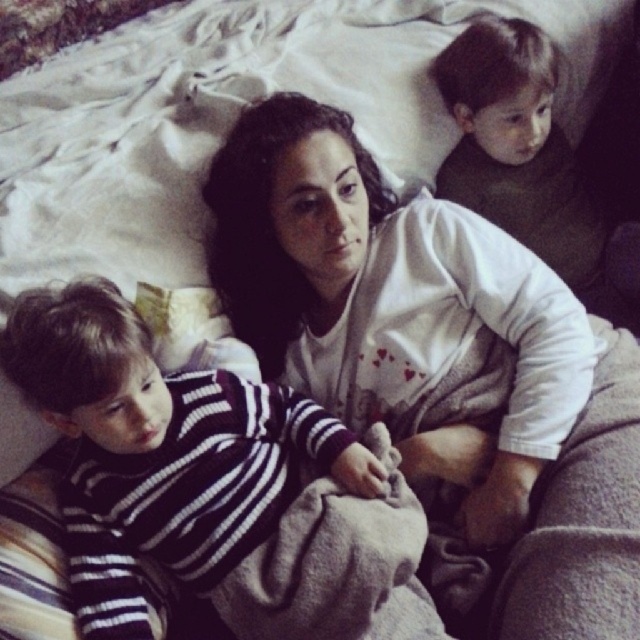
Between white soft sweater at center and striped knit sweater at left, which one is positioned lower?

striped knit sweater at left is below.

Which is more to the left, white soft sweater at center or striped knit sweater at left?

Positioned to the left is striped knit sweater at left.

Between point (540, 456) and point (147, 484), which one is positioned behind?

Point (540, 456)

Locate an element on the screen. This screenshot has height=640, width=640. white soft sweater at center is located at coordinates (388, 296).

The image size is (640, 640). Describe the element at coordinates (161, 451) in the screenshot. I see `striped knit sweater at left` at that location.

Can you confirm if striped knit sweater at left is positioned below dark green sweater at upper right?

Correct, striped knit sweater at left is located below dark green sweater at upper right.

At what (x,y) coordinates should I click in order to perform the action: click on striped knit sweater at left. Please return your answer as a coordinate pair (x, y). Looking at the image, I should click on (161, 451).

At what (x,y) coordinates should I click in order to perform the action: click on striped knit sweater at left. Please return your answer as a coordinate pair (x, y). Image resolution: width=640 pixels, height=640 pixels. Looking at the image, I should click on (161, 451).

The height and width of the screenshot is (640, 640). What are the coordinates of `white soft sweater at center` in the screenshot? It's located at (388, 296).

Is point (358, 291) closer to camera compared to point (484, 198)?

Yes, it is.

The width and height of the screenshot is (640, 640). I want to click on white soft sweater at center, so click(x=388, y=296).